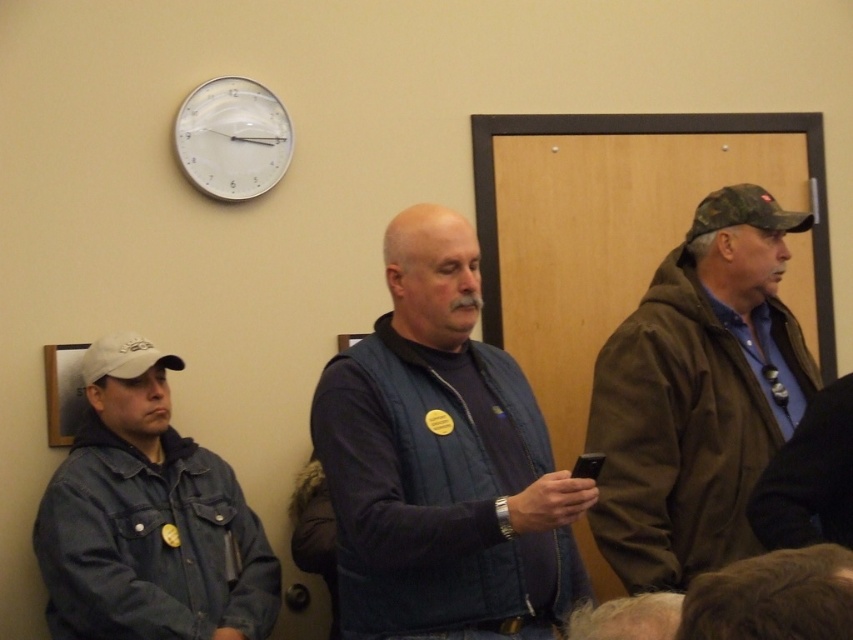
Question: Does denim jacket at left come behind white plastic clock at upper center?

Choices:
 (A) yes
 (B) no

Answer: (B)

Question: Can you confirm if denim jacket at left is thinner than white plastic clock at upper center?

Choices:
 (A) no
 (B) yes

Answer: (A)

Question: Which of these objects is positioned closest to the blue denim vest at center?

Choices:
 (A) black plastic phone at center
 (B) white plastic clock at upper center
 (C) denim jacket at left

Answer: (A)

Question: Which is farther from the denim jacket at left?

Choices:
 (A) black plastic phone at center
 (B) blue denim vest at center
 (C) camouflage fabric hat at right

Answer: (C)

Question: Which object is positioned closest to the black plastic phone at center?

Choices:
 (A) white plastic clock at upper center
 (B) denim jacket at left
 (C) camouflage fabric hat at right
 (D) blue denim vest at center

Answer: (D)

Question: Is blue denim vest at center below white plastic clock at upper center?

Choices:
 (A) yes
 (B) no

Answer: (A)